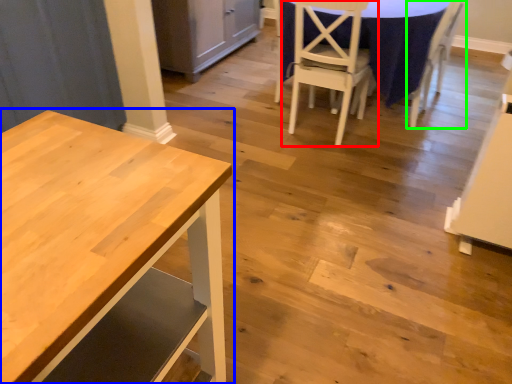
Question: Which object is the closest to the chair (highlighted by a red box)? Choose among these: table (highlighted by a blue box) or chair (highlighted by a green box).

Choices:
 (A) table
 (B) chair

Answer: (B)